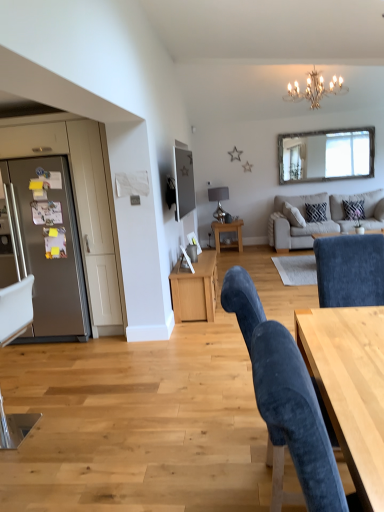
Question: Considering the relative sizes of beige fabric couch at upper right and metallic silver chair at left, the 1th chair from the back, in the image provided, is beige fabric couch at upper right wider than metallic silver chair at left, the 1th chair from the back,?

Choices:
 (A) no
 (B) yes

Answer: (B)

Question: Can you confirm if beige fabric couch at upper right is positioned to the right of metallic silver chair at left, the first chair when ordered from left to right?

Choices:
 (A) yes
 (B) no

Answer: (A)

Question: From the image's perspective, would you say beige fabric couch at upper right is shown under metallic silver chair at left, the 1th chair from the back?

Choices:
 (A) no
 (B) yes

Answer: (A)

Question: From a real-world perspective, is beige fabric couch at upper right on metallic silver chair at left, the second chair when ordered from front to back?

Choices:
 (A) yes
 (B) no

Answer: (B)

Question: Considering the relative sizes of beige fabric couch at upper right and metallic silver chair at left, the second chair when ordered from front to back, in the image provided, is beige fabric couch at upper right shorter than metallic silver chair at left, the second chair when ordered from front to back,?

Choices:
 (A) yes
 (B) no

Answer: (A)

Question: Considering their positions, is light wood desk at lower right located in front of or behind gold metallic chandelier at upper center, the second lamp in the left-to-right sequence?

Choices:
 (A) front
 (B) behind

Answer: (A)

Question: Is light wood desk at lower right spatially inside gold metallic chandelier at upper center, arranged as the 1th lamp when viewed from the right, or outside of it?

Choices:
 (A) outside
 (B) inside

Answer: (A)

Question: Considering the positions of light wood desk at lower right and gold metallic chandelier at upper center, the 1th lamp when ordered from front to back, in the image, is light wood desk at lower right wider or thinner than gold metallic chandelier at upper center, the 1th lamp when ordered from front to back,?

Choices:
 (A) wide
 (B) thin

Answer: (B)

Question: In the image, is light wood desk at lower right on the left side or the right side of gold metallic chandelier at upper center, arranged as the 1th lamp when viewed from the right?

Choices:
 (A) right
 (B) left

Answer: (B)

Question: Is gold metallic chandelier at upper center, the second lamp in the left-to-right sequence, wider or thinner than zebra-patterned fabric pillow at upper right, the first pillow when ordered from right to left?

Choices:
 (A) thin
 (B) wide

Answer: (B)

Question: Is gold metallic chandelier at upper center, arranged as the 1th lamp when viewed from the right, taller or shorter than zebra-patterned fabric pillow at upper right, the 2th pillow in the left-to-right sequence?

Choices:
 (A) tall
 (B) short

Answer: (A)

Question: Is point (334, 76) closer or farther from the camera than point (357, 202)?

Choices:
 (A) farther
 (B) closer

Answer: (B)

Question: From a real-world perspective, is gold metallic chandelier at upper center, the 2th lamp from the back, physically located above or below zebra-patterned fabric pillow at upper right, the 2th pillow in the left-to-right sequence?

Choices:
 (A) above
 (B) below

Answer: (A)

Question: Based on their positions, is zebra-patterned fabric pillow at upper right, the first pillow when ordered from right to left, located to the left or right of velvet blue chair at lower right, which is the 1th chair in front-to-back order?

Choices:
 (A) right
 (B) left

Answer: (A)

Question: From the image's perspective, is zebra-patterned fabric pillow at upper right, the first pillow when ordered from right to left, above or below velvet blue chair at lower right, which ranks as the first chair in right-to-left order?

Choices:
 (A) below
 (B) above

Answer: (B)